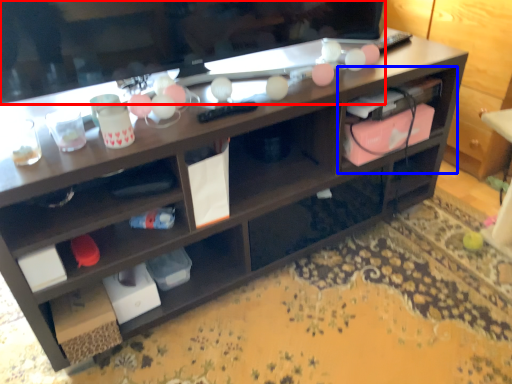
Question: Which of the following is the farthest to the observer, television (highlighted by a red box) or cabinet (highlighted by a blue box)?

Choices:
 (A) television
 (B) cabinet

Answer: (B)